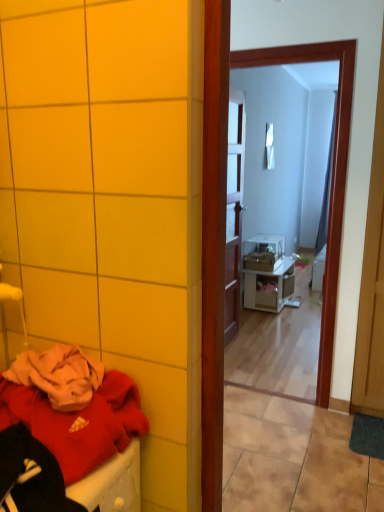
Question: Does point (286, 286) appear closer or farther from the camera than point (110, 429)?

Choices:
 (A) farther
 (B) closer

Answer: (A)

Question: In the image, is white glossy nightstand at center positioned in front of or behind matte red sweater at lower left?

Choices:
 (A) front
 (B) behind

Answer: (B)

Question: Which of these objects is positioned farthest from the white glossy mirror at upper center, which ranks as the 1th mirror in left-to-right order?

Choices:
 (A) white glossy nightstand at center
 (B) matte red sweater at lower left
 (C) wooden door at center
 (D) white glossy mirror at upper center, which ranks as the 2th mirror in left-to-right order

Answer: (D)

Question: Which object is positioned closest to the matte red sweater at lower left?

Choices:
 (A) white glossy mirror at upper center, which is the 2th mirror in right-to-left order
 (B) wooden door at center
 (C) white glossy nightstand at center
 (D) white glossy mirror at upper center, positioned as the 2th mirror in front-to-back order

Answer: (A)